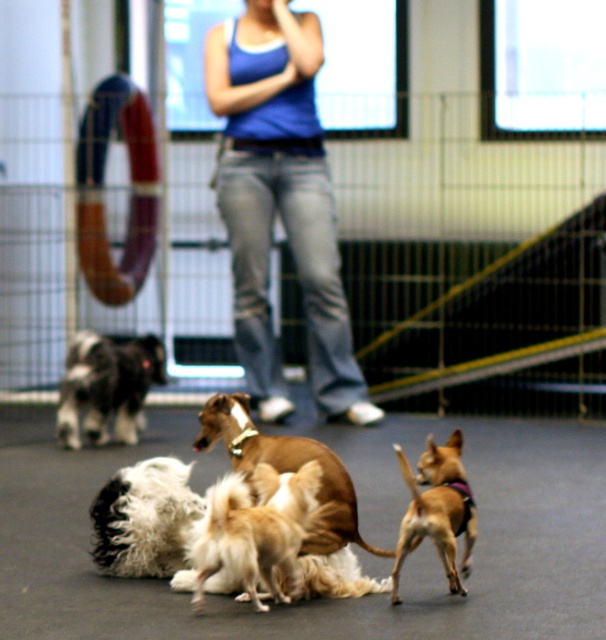
Question: Which object appears farthest from the camera in this image?

Choices:
 (A) brown fur dog at center
 (B) black and white fur at left
 (C) blue denim jeans at center
 (D) fluffy white dog at center

Answer: (C)

Question: Which point is farther from the camera taking this photo?

Choices:
 (A) tap(282, 20)
 (B) tap(95, 404)

Answer: (A)

Question: Which object is the farthest from the brown fur dog at center?

Choices:
 (A) light brown fur at center
 (B) fluffy white dog at center
 (C) blue denim jeans at center

Answer: (C)

Question: Can you confirm if brown fur dog at center is wider than black and white fur at left?

Choices:
 (A) no
 (B) yes

Answer: (B)

Question: Does black and white fur at left lie behind light brown fur at center?

Choices:
 (A) no
 (B) yes

Answer: (B)

Question: From the image, what is the correct spatial relationship of brown fur dog at center in relation to golden fur dog at center?

Choices:
 (A) below
 (B) above

Answer: (B)